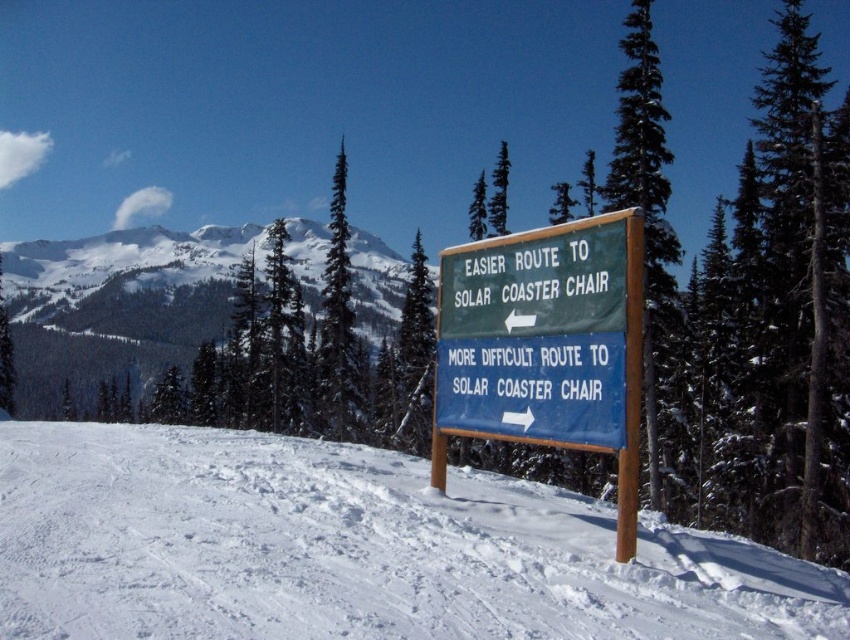
Can you confirm if white snow at center is smaller than green wooden sign at center?

Actually, white snow at center might be larger than green wooden sign at center.

Is white snow at center closer to camera compared to green wooden sign at center?

Yes.

Locate an element on the screen. The image size is (850, 640). white snow at center is located at coordinates (353, 548).